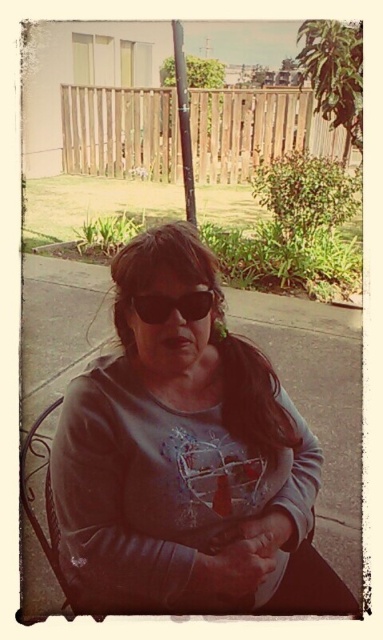
Question: Is the position of gray fleece sweatshirt at center less distant than that of black plastic sunglasses at center?

Choices:
 (A) no
 (B) yes

Answer: (B)

Question: Is gray fleece sweatshirt at center positioned behind black plastic sunglasses at center?

Choices:
 (A) no
 (B) yes

Answer: (A)

Question: Which of the following is the closest to the observer?

Choices:
 (A) (70, 433)
 (B) (175, 308)

Answer: (B)

Question: Which point is closer to the camera?

Choices:
 (A) (163, 308)
 (B) (122, 451)

Answer: (A)

Question: Is gray fleece sweatshirt at center thinner than black plastic sunglasses at center?

Choices:
 (A) no
 (B) yes

Answer: (A)

Question: Which of the following is the closest to the observer?

Choices:
 (A) black plastic sunglasses at center
 (B) gray fleece sweatshirt at center

Answer: (B)